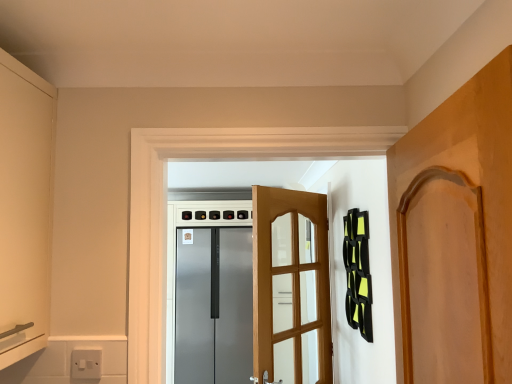
This screenshot has height=384, width=512. I want to click on wooden door at right, which appears as the 1th door when viewed from the front, so click(457, 230).

At what (x,y) coordinates should I click in order to perform the action: click on satin silver refrigerator at center. Please return your answer as a coordinate pair (x, y). Image resolution: width=512 pixels, height=384 pixels. Looking at the image, I should click on (175, 252).

What do you see at coordinates (86, 364) in the screenshot? The height and width of the screenshot is (384, 512). I see `white plastic switch at lower left` at bounding box center [86, 364].

Where is `wooden door at right, which appears as the 1th door when viewed from the front`? The image size is (512, 384). wooden door at right, which appears as the 1th door when viewed from the front is located at coordinates (457, 230).

Is wooden door at center, the second door positioned from the front, outside of wooden door at right, which appears as the 1th door when viewed from the front?

Yes, wooden door at center, the second door positioned from the front, is located beyond the bounds of wooden door at right, which appears as the 1th door when viewed from the front.

From a real-world perspective, is wooden door at center, the second door positioned from the front, positioned under wooden door at right, which appears as the 1th door when viewed from the front, based on gravity?

Yes, from a real-world perspective, wooden door at center, the second door positioned from the front, is under wooden door at right, which appears as the 1th door when viewed from the front.

Which object is closer to the camera, wooden door at center, positioned as the first door in back-to-front order, or wooden door at right, the 2th door positioned from the back?

wooden door at right, the 2th door positioned from the back, is closer to the camera.

Is wooden door at center, the second door positioned from the front, bigger or smaller than wooden door at right, which appears as the 1th door when viewed from the front?

In the image, wooden door at center, the second door positioned from the front, appears to be larger than wooden door at right, which appears as the 1th door when viewed from the front.

Could you tell me if satin silver refrigerator at center is turned towards wooden door at center, the second door positioned from the front?

Yes, satin silver refrigerator at center faces towards wooden door at center, the second door positioned from the front.

How much distance is there between satin silver refrigerator at center and wooden door at center, the second door positioned from the front?

satin silver refrigerator at center is 5.47 feet away from wooden door at center, the second door positioned from the front.

Starting from the satin silver refrigerator at center, which door is the 1st one to the right? Please provide its 2D coordinates.

[(291, 286)]

Looking at the image, does satin silver refrigerator at center seem bigger or smaller compared to wooden door at center, the second door positioned from the front?

In the image, satin silver refrigerator at center appears to be larger than wooden door at center, the second door positioned from the front.

From the image's perspective, is white plastic switch at lower left under wooden door at center, the second door positioned from the front?

Actually, white plastic switch at lower left appears above wooden door at center, the second door positioned from the front, in the image.

Is white plastic switch at lower left not within wooden door at center, the second door positioned from the front?

Yes.

How many degrees apart are the facing directions of white plastic switch at lower left and wooden door at center, the second door positioned from the front?

They differ by 128 degrees in their facing directions.

You are a GUI agent. You are given a task and a screenshot of the screen. Output one action in this format:
    pyautogui.click(x=<x>, y=<y>)
    Task: Click on the electric outlet that appears below the wooden door at center, the second door positioned from the front (from a real-world perspective)
    
    Given the screenshot: What is the action you would take?
    pyautogui.click(x=86, y=364)

Which door is the 2nd one when counting from the right side of the white plastic switch at lower left? Please provide its 2D coordinates.

[(457, 230)]

Measure the distance between white plastic switch at lower left and wooden door at right, which appears as the 1th door when viewed from the front.

white plastic switch at lower left and wooden door at right, which appears as the 1th door when viewed from the front, are 3.37 feet apart from each other.

Which is correct: white plastic switch at lower left is inside wooden door at right, the 2th door positioned from the back, or outside of it?

white plastic switch at lower left is located beyond the bounds of wooden door at right, the 2th door positioned from the back.

Which object is positioned more to the right, wooden door at center, positioned as the first door in back-to-front order, or satin silver refrigerator at center?

wooden door at center, positioned as the first door in back-to-front order.

Is the surface of wooden door at center, positioned as the first door in back-to-front order, in direct contact with satin silver refrigerator at center?

No, wooden door at center, positioned as the first door in back-to-front order, is not in contact with satin silver refrigerator at center.

Does wooden door at right, the 2th door positioned from the back, have a greater height compared to white plastic switch at lower left?

Yes.

Which door is the 2nd one when counting from the right side of the white plastic switch at lower left? Please provide its 2D coordinates.

[(457, 230)]

Is point (430, 196) positioned before point (99, 370)?

Yes, it is in front of point (99, 370).

Can you confirm if wooden door at right, the 2th door positioned from the back, is thinner than white plastic switch at lower left?

Incorrect, the width of wooden door at right, the 2th door positioned from the back, is not less than that of white plastic switch at lower left.

Considering the relative sizes of white plastic switch at lower left and satin silver refrigerator at center in the image provided, is white plastic switch at lower left shorter than satin silver refrigerator at center?

Indeed, white plastic switch at lower left has a lesser height compared to satin silver refrigerator at center.

Choose the correct answer: Is white plastic switch at lower left inside satin silver refrigerator at center or outside it?

white plastic switch at lower left is located beyond the bounds of satin silver refrigerator at center.

Could you tell me if white plastic switch at lower left is facing satin silver refrigerator at center?

No, white plastic switch at lower left is not aimed at satin silver refrigerator at center.

From a real-world perspective, who is located lower, white plastic switch at lower left or satin silver refrigerator at center?

In real-world perspective, satin silver refrigerator at center is lower.

This screenshot has width=512, height=384. Identify the location of door located in front of the wooden door at center, the second door positioned from the front. (457, 230).

Locate an element on the screen. appliance on the left of wooden door at center, the second door positioned from the front is located at coordinates (175, 252).

Which object lies further to the anchor point satin silver refrigerator at center, wooden door at right, the 2th door positioned from the back, or wooden door at center, the second door positioned from the front?

The object further to satin silver refrigerator at center is wooden door at right, the 2th door positioned from the back.

Considering their positions, is white plastic switch at lower left positioned closer to wooden door at center, positioned as the first door in back-to-front order, than satin silver refrigerator at center?

white plastic switch at lower left is closer to wooden door at center, positioned as the first door in back-to-front order.

When comparing their distances from white plastic switch at lower left, does wooden door at right, the 2th door positioned from the back, or satin silver refrigerator at center seem closer?

The object closer to white plastic switch at lower left is wooden door at right, the 2th door positioned from the back.

Looking at the image, which one is located closer to wooden door at right, which appears as the 1th door when viewed from the front, satin silver refrigerator at center or wooden door at center, the second door positioned from the front?

The object closer to wooden door at right, which appears as the 1th door when viewed from the front, is wooden door at center, the second door positioned from the front.

When comparing their distances from white plastic switch at lower left, does wooden door at center, positioned as the first door in back-to-front order, or wooden door at right, the 2th door positioned from the back, seem further?

wooden door at center, positioned as the first door in back-to-front order, lies further to white plastic switch at lower left than the other object.

When comparing their distances from wooden door at right, the 2th door positioned from the back, does wooden door at center, the second door positioned from the front, or satin silver refrigerator at center seem further?

satin silver refrigerator at center.

Which object lies nearer to the anchor point wooden door at right, which appears as the 1th door when viewed from the front, wooden door at center, the second door positioned from the front, or white plastic switch at lower left?

The object closer to wooden door at right, which appears as the 1th door when viewed from the front, is white plastic switch at lower left.

From the image, which object appears to be farther from wooden door at center, the second door positioned from the front, satin silver refrigerator at center or wooden door at right, which appears as the 1th door when viewed from the front?

satin silver refrigerator at center lies further to wooden door at center, the second door positioned from the front, than the other object.

Identify the location of electric outlet positioned between wooden door at right, the 2th door positioned from the back, and satin silver refrigerator at center from near to far. This screenshot has width=512, height=384. (86, 364).

Where is `door between white plastic switch at lower left and satin silver refrigerator at center from front to back`? This screenshot has width=512, height=384. door between white plastic switch at lower left and satin silver refrigerator at center from front to back is located at coordinates (291, 286).

Find the location of a particular element. door between wooden door at right, the 2th door positioned from the back, and satin silver refrigerator at center in the front-back direction is located at coordinates [291, 286].

The height and width of the screenshot is (384, 512). I want to click on electric outlet located between wooden door at right, which appears as the 1th door when viewed from the front, and wooden door at center, positioned as the first door in back-to-front order, in the depth direction, so [86, 364].